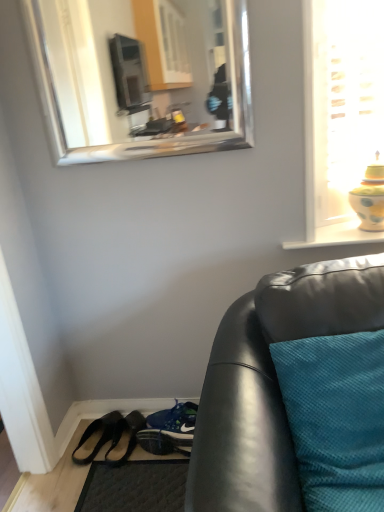
I want to click on blue fabric shoe at lower center, which appears as the 2th shoe when viewed from the front, so click(x=175, y=418).

The image size is (384, 512). Describe the element at coordinates (142, 76) in the screenshot. I see `silver/metallic mirror at upper center` at that location.

Describe the element at coordinates (321, 298) in the screenshot. I see `teal fabric cushion at lower right` at that location.

Where is `blue suede sneakers at lower center, the 2th shoe from the back`? blue suede sneakers at lower center, the 2th shoe from the back is located at coordinates (169, 430).

Locate an element on the screen. blue fabric shoe at lower center, the 1th shoe positioned from the back is located at coordinates (175, 418).

From a real-world perspective, is dark gray textured mat at lower left over blue fabric shoe at lower center, the 1th shoe positioned from the back?

No, from a real-world perspective, dark gray textured mat at lower left is not above blue fabric shoe at lower center, the 1th shoe positioned from the back.

Is dark gray textured mat at lower left thinner than blue fabric shoe at lower center, which appears as the 2th shoe when viewed from the front?

Yes.

Based on their positions, is dark gray textured mat at lower left located to the left or right of blue fabric shoe at lower center, which appears as the 2th shoe when viewed from the front?

dark gray textured mat at lower left is to the left of blue fabric shoe at lower center, which appears as the 2th shoe when viewed from the front.

Which is nearer, (173, 425) or (100, 510)?

Point (173, 425) is farther from the camera than point (100, 510).

Considering the relative positions of blue fabric shoe at lower center, the 1th shoe positioned from the back, and dark gray textured mat at lower left in the image provided, is blue fabric shoe at lower center, the 1th shoe positioned from the back, to the right of dark gray textured mat at lower left from the viewer's perspective?

Correct, you'll find blue fabric shoe at lower center, the 1th shoe positioned from the back, to the right of dark gray textured mat at lower left.

Can you tell me how much blue fabric shoe at lower center, the 1th shoe positioned from the back, and dark gray textured mat at lower left differ in facing direction?

blue fabric shoe at lower center, the 1th shoe positioned from the back, and dark gray textured mat at lower left are facing 94.2 degrees away from each other.

Would you consider blue fabric shoe at lower center, which appears as the 2th shoe when viewed from the front, to be distant from dark gray textured mat at lower left?

No, blue fabric shoe at lower center, which appears as the 2th shoe when viewed from the front, is not far away from dark gray textured mat at lower left.

Could you measure the distance between blue fabric shoe at lower center, the 1th shoe positioned from the back, and teal fabric cushion at lower right?

blue fabric shoe at lower center, the 1th shoe positioned from the back, is 31.04 inches from teal fabric cushion at lower right.

From the image's perspective, does blue fabric shoe at lower center, the 1th shoe positioned from the back, appear higher than teal fabric cushion at lower right?

No, from the image's perspective, blue fabric shoe at lower center, the 1th shoe positioned from the back, is not on top of teal fabric cushion at lower right.

Which is nearer, (167, 412) or (365, 274)?

The point (365, 274) is more forward.

Is silver/metallic mirror at upper center at the right side of dark gray textured mat at lower left?

Indeed, silver/metallic mirror at upper center is positioned on the right side of dark gray textured mat at lower left.

Which object is closer to the camera taking this photo, silver/metallic mirror at upper center or dark gray textured mat at lower left?

silver/metallic mirror at upper center.

Between silver/metallic mirror at upper center and dark gray textured mat at lower left, which one has smaller width?

silver/metallic mirror at upper center is thinner.

From the image's perspective, does silver/metallic mirror at upper center appear lower than dark gray textured mat at lower left?

Incorrect, from the image's perspective, silver/metallic mirror at upper center is higher than dark gray textured mat at lower left.

Is dark gray textured mat at lower left in front of or behind teal fabric cushion at lower right in the image?

dark gray textured mat at lower left is positioned farther from the viewer than teal fabric cushion at lower right.

Are dark gray textured mat at lower left and teal fabric cushion at lower right beside each other?

dark gray textured mat at lower left and teal fabric cushion at lower right are clearly separated.

Which is behind, point (127, 509) or point (345, 317)?

The point (127, 509) is farther.

Can you confirm if dark gray textured mat at lower left is smaller than teal fabric cushion at lower right?

Indeed, dark gray textured mat at lower left has a smaller size compared to teal fabric cushion at lower right.

Can you confirm if silver/metallic mirror at upper center is taller than blue suede sneakers at lower center, the 2th shoe from the back?

Correct, silver/metallic mirror at upper center is much taller as blue suede sneakers at lower center, the 2th shoe from the back.

Consider the image. Is blue suede sneakers at lower center, the 2th shoe from the back, completely or partially inside silver/metallic mirror at upper center?

No, silver/metallic mirror at upper center does not contain blue suede sneakers at lower center, the 2th shoe from the back.

Who is smaller, silver/metallic mirror at upper center or blue suede sneakers at lower center, placed as the 1th shoe when sorted from front to back?

blue suede sneakers at lower center, placed as the 1th shoe when sorted from front to back, is smaller.

From a real-world perspective, which object rests below the other?

blue suede sneakers at lower center, placed as the 1th shoe when sorted from front to back, is physically lower.

From a real-world perspective, relative to black leather shoes at lower left, which appears as the first footwear when viewed from the right, is blue fabric shoe at lower center, which appears as the 2th shoe when viewed from the front, vertically above or below?

blue fabric shoe at lower center, which appears as the 2th shoe when viewed from the front, is above black leather shoes at lower left, which appears as the first footwear when viewed from the right.

Are blue fabric shoe at lower center, the 1th shoe positioned from the back, and black leather shoes at lower left, positioned as the second footwear in left-to-right order, located far from each other?

No, blue fabric shoe at lower center, the 1th shoe positioned from the back, is not far from black leather shoes at lower left, positioned as the second footwear in left-to-right order.

From the image's perspective, which one is positioned lower, blue fabric shoe at lower center, which appears as the 2th shoe when viewed from the front, or black leather shoes at lower left, which appears as the first footwear when viewed from the right?

black leather shoes at lower left, which appears as the first footwear when viewed from the right.

From the dark gray textured mat at lower left, count 2nd shoes backward and point to it. Please provide its 2D coordinates.

[(175, 418)]

I want to click on flat that appears below the blue fabric shoe at lower center, the 1th shoe positioned from the back (from a real-world perspective), so click(x=135, y=487).

From the image, which object appears to be nearer to black leather shoes at lower left, which is counted as the 1th footwear, starting from the left, dark gray textured mat at lower left or blue suede sneakers at lower center, placed as the 1th shoe when sorted from front to back?

Based on the image, dark gray textured mat at lower left appears to be nearer to black leather shoes at lower left, which is counted as the 1th footwear, starting from the left.

Based on their spatial positions, is blue suede sneakers at lower center, the 2th shoe from the back, or black leather shoes at lower left, which is counted as the 1th footwear, starting from the left, further from silver/metallic mirror at upper center?

The object further to silver/metallic mirror at upper center is black leather shoes at lower left, which is counted as the 1th footwear, starting from the left.

Looking at the image, which one is located closer to blue fabric shoe at lower center, the 1th shoe positioned from the back, black leather shoes at lower left, positioned as the second footwear in left-to-right order, or silver/metallic mirror at upper center?

Among the two, black leather shoes at lower left, positioned as the second footwear in left-to-right order, is located nearer to blue fabric shoe at lower center, the 1th shoe positioned from the back.

Based on their spatial positions, is blue fabric shoe at lower center, which appears as the 2th shoe when viewed from the front, or black leather shoes at lower left, which is counted as the 1th footwear, starting from the left, further from dark gray textured mat at lower left?

black leather shoes at lower left, which is counted as the 1th footwear, starting from the left, is further to dark gray textured mat at lower left.

When comparing their distances from black leather shoes at lower left, which is counted as the 1th footwear, starting from the left, does black leather shoes at lower left, which appears as the first footwear when viewed from the right, or dark gray textured mat at lower left seem further?

Among the two, dark gray textured mat at lower left is located further to black leather shoes at lower left, which is counted as the 1th footwear, starting from the left.

When comparing their distances from blue fabric shoe at lower center, the 1th shoe positioned from the back, does black leather shoes at lower left, positioned as the second footwear in left-to-right order, or dark gray textured mat at lower left seem closer?

black leather shoes at lower left, positioned as the second footwear in left-to-right order.

Estimate the real-world distances between objects in this image. Which object is closer to blue fabric shoe at lower center, the 1th shoe positioned from the back, blue suede sneakers at lower center, the 2th shoe from the back, or silver/metallic mirror at upper center?

blue suede sneakers at lower center, the 2th shoe from the back, lies closer to blue fabric shoe at lower center, the 1th shoe positioned from the back, than the other object.

From the image, which object appears to be farther from black leather shoes at lower left, which appears as the first footwear when viewed from the right, dark gray textured mat at lower left or silver/metallic mirror at upper center?

silver/metallic mirror at upper center lies further to black leather shoes at lower left, which appears as the first footwear when viewed from the right, than the other object.

What are the coordinates of `footwear between teal fabric cushion at lower right and black leather shoes at lower left, which is counted as the 1th footwear, starting from the left, from front to back` in the screenshot? It's located at (124, 438).

The image size is (384, 512). Find the location of `shoe located between teal fabric cushion at lower right and black leather shoes at lower left, positioned as the second footwear in left-to-right order, in the depth direction`. shoe located between teal fabric cushion at lower right and black leather shoes at lower left, positioned as the second footwear in left-to-right order, in the depth direction is located at coordinates (169, 430).

Locate an element on the screen. flat between teal fabric cushion at lower right and blue fabric shoe at lower center, which appears as the 2th shoe when viewed from the front, along the z-axis is located at coordinates (135, 487).

The image size is (384, 512). Find the location of `shoe positioned between teal fabric cushion at lower right and black leather shoes at lower left, which ranks as the second footwear in right-to-left order, from near to far`. shoe positioned between teal fabric cushion at lower right and black leather shoes at lower left, which ranks as the second footwear in right-to-left order, from near to far is located at coordinates (169, 430).